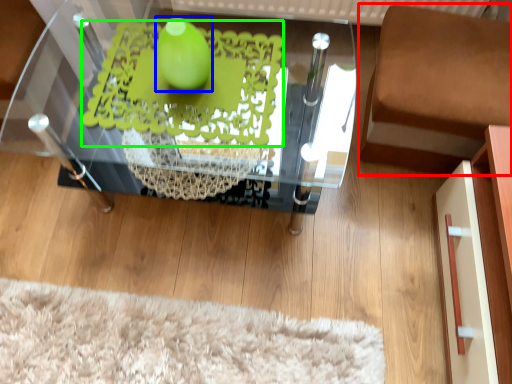
Question: Which object is positioned farthest from furniture (highlighted by a red box)? Select from lime (highlighted by a blue box) and design (highlighted by a green box).

Choices:
 (A) lime
 (B) design

Answer: (A)